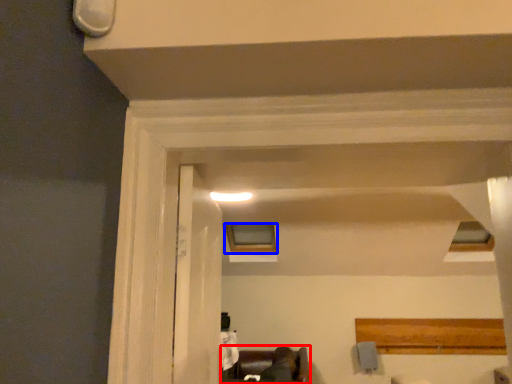
Question: Which object appears farthest to the camera in this image, furniture (highlighted by a red box) or window (highlighted by a blue box)?

Choices:
 (A) furniture
 (B) window

Answer: (B)